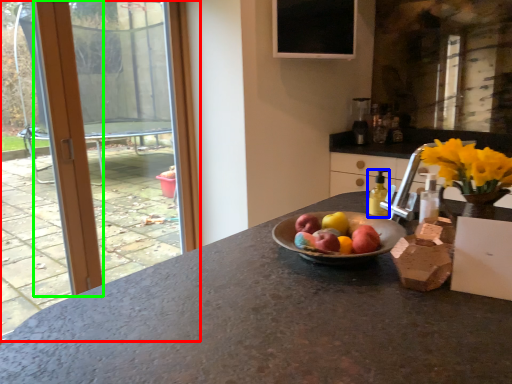
Question: Based on their relative distances, which object is farther from window (highlighted by a red box)? Choose from bottle (highlighted by a blue box) and door (highlighted by a green box).

Choices:
 (A) bottle
 (B) door

Answer: (A)